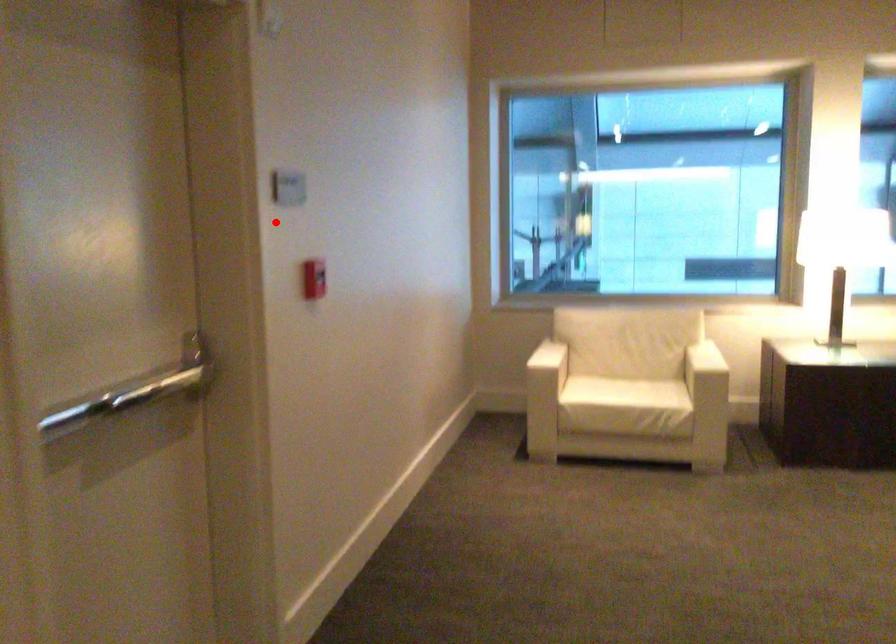
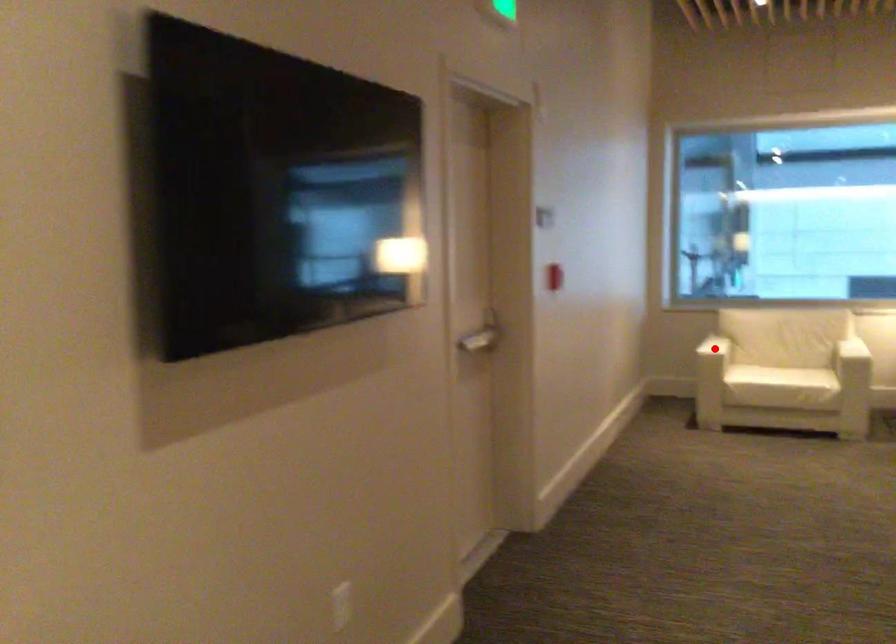
I am providing you with two images of the same scene from different viewpoints. A red point is marked on the first image and another point is marked on the second image. Is the marked point in image1 the same physical position as the marked point in image2?

No